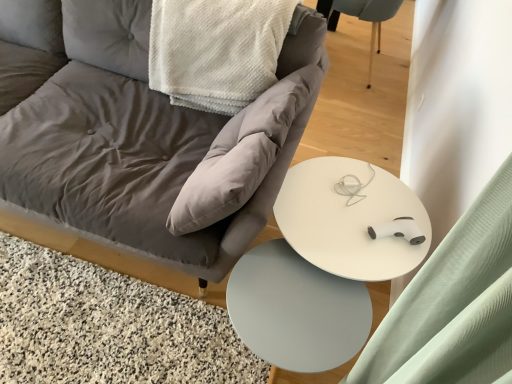
Question: Is white glossy round table at center oriented away from matte gray fabric chair at center?

Choices:
 (A) yes
 (B) no

Answer: (B)

Question: Are white glossy round table at center and matte gray fabric chair at center located far from each other?

Choices:
 (A) yes
 (B) no

Answer: (B)

Question: Could you tell me if white glossy round table at center is facing matte gray fabric chair at center?

Choices:
 (A) no
 (B) yes

Answer: (A)

Question: From the image's perspective, is white glossy round table at center on top of matte gray fabric chair at center?

Choices:
 (A) no
 (B) yes

Answer: (A)

Question: Can you confirm if white glossy round table at center is bigger than matte gray fabric chair at center?

Choices:
 (A) no
 (B) yes

Answer: (A)

Question: Is white matte table at center in front of or behind light blue fabric swivel chair at upper right in the image?

Choices:
 (A) front
 (B) behind

Answer: (A)

Question: From the image's perspective, is white matte table at center located above or below light blue fabric swivel chair at upper right?

Choices:
 (A) above
 (B) below

Answer: (B)

Question: In the image, is white matte table at center on the left side or the right side of light blue fabric swivel chair at upper right?

Choices:
 (A) right
 (B) left

Answer: (B)

Question: In terms of height, does white matte table at center look taller or shorter compared to light blue fabric swivel chair at upper right?

Choices:
 (A) tall
 (B) short

Answer: (B)

Question: Would you say light blue fabric swivel chair at upper right is inside or outside matte gray fabric chair at center?

Choices:
 (A) outside
 (B) inside

Answer: (A)

Question: From a real-world perspective, is light blue fabric swivel chair at upper right physically located above or below matte gray fabric chair at center?

Choices:
 (A) below
 (B) above

Answer: (A)

Question: Is light blue fabric swivel chair at upper right to the left or to the right of matte gray fabric chair at center in the image?

Choices:
 (A) left
 (B) right

Answer: (B)

Question: Considering the positions of point (373, 18) and point (179, 261), is point (373, 18) closer or farther from the camera than point (179, 261)?

Choices:
 (A) farther
 (B) closer

Answer: (A)

Question: In terms of height, does white glossy round table at center look taller or shorter compared to matte gray fabric chair at center?

Choices:
 (A) short
 (B) tall

Answer: (A)

Question: From the image's perspective, relative to matte gray fabric chair at center, is white glossy round table at center above or below?

Choices:
 (A) below
 (B) above

Answer: (A)